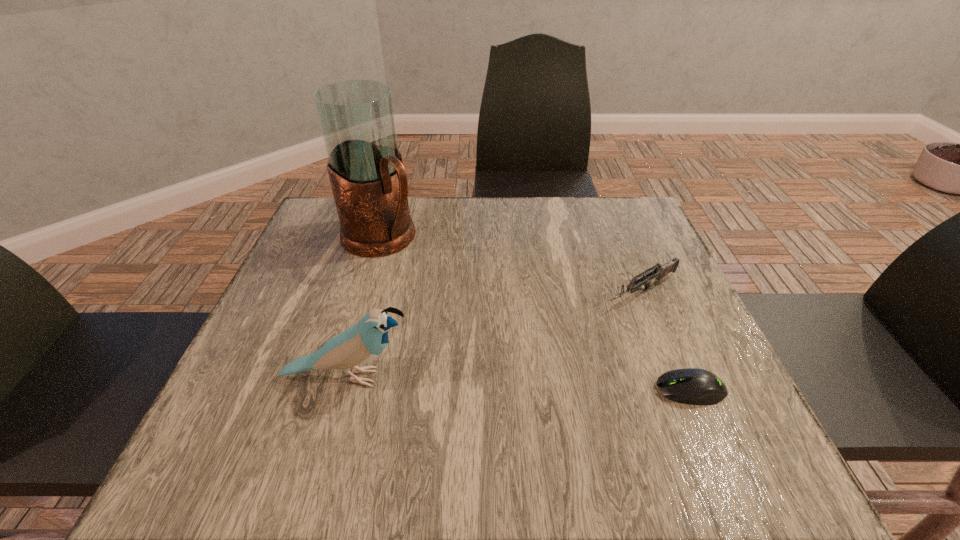
Where is `free space located with the handle on the side of the pitcher`? The height and width of the screenshot is (540, 960). free space located with the handle on the side of the pitcher is located at coordinates (455, 303).

The width and height of the screenshot is (960, 540). What are the coordinates of `free space located 0.400m with the handle on the side of the pitcher` in the screenshot? It's located at (521, 359).

This screenshot has width=960, height=540. I want to click on blank area located 0.120m with the handle on the side of the pitcher, so click(x=433, y=284).

The height and width of the screenshot is (540, 960). Find the location of `free location located 0.070m aimed along the barrel of the third nearest object`. free location located 0.070m aimed along the barrel of the third nearest object is located at coordinates (588, 319).

The width and height of the screenshot is (960, 540). Identify the location of free region located aimed along the barrel of the third nearest object. (544, 344).

Identify the location of vacant area situated 0.140m aimed along the barrel of the third nearest object. (564, 333).

The width and height of the screenshot is (960, 540). What are the coordinates of `object that is at the far edge` in the screenshot? It's located at (369, 182).

Identify the location of bird present at the near edge. This screenshot has height=540, width=960. (361, 343).

Locate an element on the screen. computer mouse at the near edge is located at coordinates (692, 386).

Identify the location of bird that is at the left edge. (361, 343).